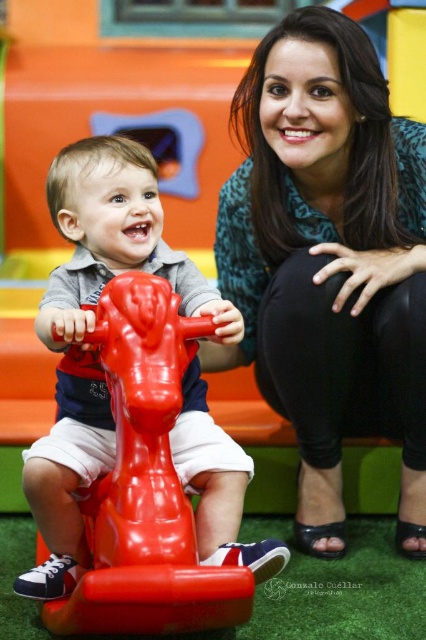
You are a photographer setting up a camera in the play area. You want to ensure both the matte green blouse at center and the rubber toy horse at center are clearly visible in the shot. Based on their sizes, which object should you focus on first to ensure proper focus?

The matte green blouse at center has a larger size compared to the rubber toy horse at center, so you should focus on the matte green blouse at center first since larger objects often require more precise focusing to capture details clearly.

You are standing in the play area and want to hand the woman a toy. The toy is currently on the red plastic toy horse. Which object is closer to you, the matte green blouse at center or the red plastic toy horse?

The red plastic toy horse is closer to you because the matte green blouse at center is located at point (330, 260), which is further away.